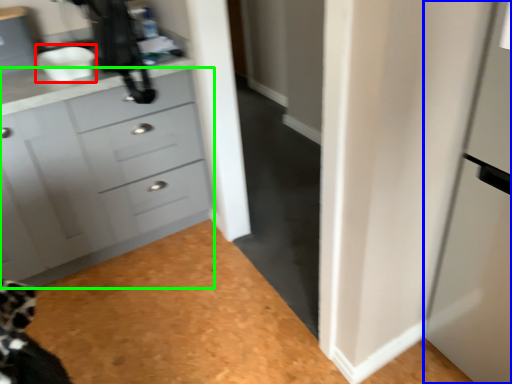
Question: Estimate the real-world distances between objects in this image. Which object is closer to sink (highlighted by a red box), screen door (highlighted by a blue box) or chest of drawers (highlighted by a green box)?

Choices:
 (A) screen door
 (B) chest of drawers

Answer: (B)